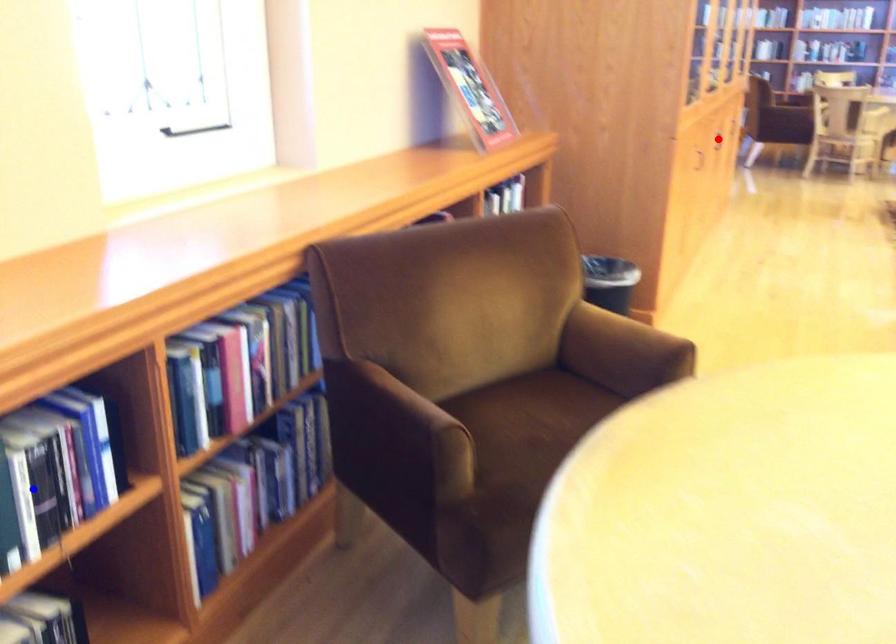
Question: Two points are marked on the image. Which point is closer to the camera?

Choices:
 (A) Blue point is closer.
 (B) Red point is closer.

Answer: (A)